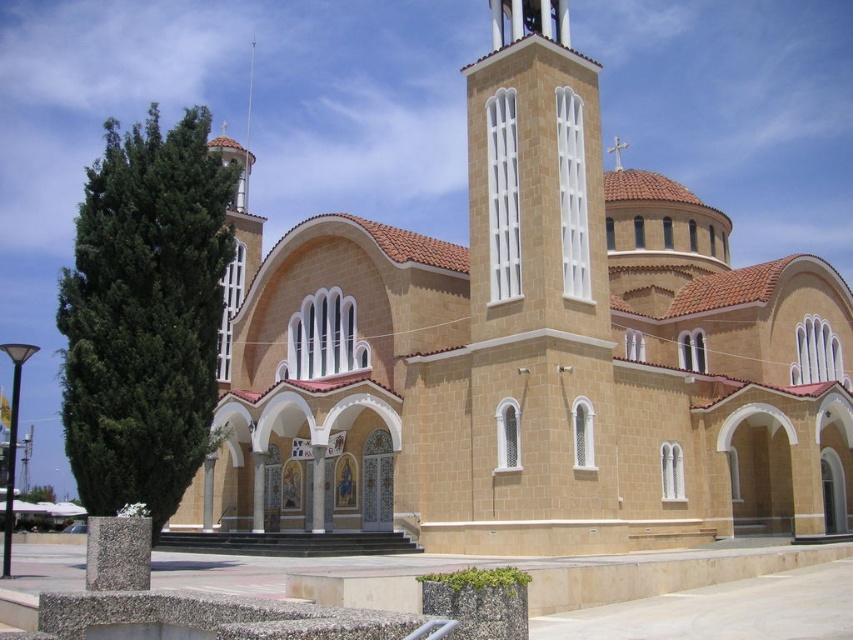
Between point (601, 204) and point (241, 198), which one is positioned behind?

Point (241, 198)

Looking at this image, is beige stone church at center to the right of smooth silver spire at upper center from the viewer's perspective?

Correct, you'll find beige stone church at center to the right of smooth silver spire at upper center.

Does point (491, 150) lie behind point (250, 52)?

No, it is not.

Where is `beige stone church at center`? This screenshot has width=853, height=640. beige stone church at center is located at coordinates (532, 353).